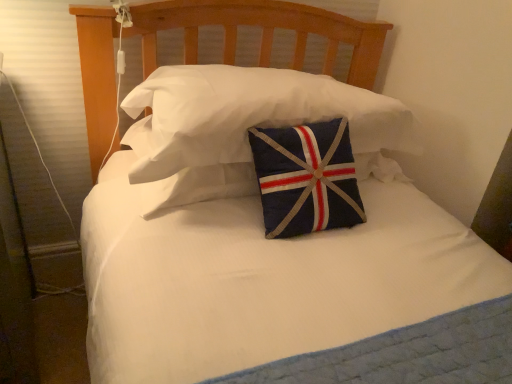
Measure the distance between point [273,116] and camera.

The distance of point [273,116] from camera is 1.03 meters.

Locate an element on the screen. quilted fabric pillow at center, which is the second pillow from bottom to top is located at coordinates (250, 115).

Describe the element at coordinates (250, 115) in the screenshot. I see `quilted fabric pillow at center, which is the second pillow from bottom to top` at that location.

Where is `navy blue fabric pillow at center, the 1th pillow from the bottom`? navy blue fabric pillow at center, the 1th pillow from the bottom is located at coordinates (199, 187).

What do you see at coordinates (199, 187) in the screenshot? The height and width of the screenshot is (384, 512). I see `navy blue fabric pillow at center, the 1th pillow from the bottom` at bounding box center [199, 187].

The height and width of the screenshot is (384, 512). Identify the location of quilted fabric pillow at center, which is the second pillow from bottom to top. (250, 115).

Which is more to the left, navy blue fabric pillow at center, which is the second pillow from top to bottom, or quilted fabric pillow at center, marked as the 1th pillow in a top-to-bottom arrangement?

From the viewer's perspective, navy blue fabric pillow at center, which is the second pillow from top to bottom, appears more on the left side.

Considering the positions of objects navy blue fabric pillow at center, the 1th pillow from the bottom, and quilted fabric pillow at center, which is the second pillow from bottom to top, in the image provided, who is behind, navy blue fabric pillow at center, the 1th pillow from the bottom, or quilted fabric pillow at center, which is the second pillow from bottom to top,?

Positioned behind is navy blue fabric pillow at center, the 1th pillow from the bottom.

Is point (154, 212) more distant than point (329, 92)?

No.

From the image's perspective, is navy blue fabric pillow at center, which is the second pillow from top to bottom, below quilted fabric pillow at center, which is the second pillow from bottom to top?

Yes, from the image's perspective, navy blue fabric pillow at center, which is the second pillow from top to bottom, is below quilted fabric pillow at center, which is the second pillow from bottom to top.

From a real-world perspective, is navy blue fabric pillow at center, which is the second pillow from top to bottom, over quilted fabric pillow at center, which is the second pillow from bottom to top?

No, from a real-world perspective, navy blue fabric pillow at center, which is the second pillow from top to bottom, is not on top of quilted fabric pillow at center, which is the second pillow from bottom to top.

In terms of width, does navy blue fabric pillow at center, the 1th pillow from the bottom, look wider or thinner when compared to quilted fabric pillow at center, marked as the 1th pillow in a top-to-bottom arrangement?

In the image, navy blue fabric pillow at center, the 1th pillow from the bottom, appears to be wider than quilted fabric pillow at center, marked as the 1th pillow in a top-to-bottom arrangement.

Considering the sizes of objects navy blue fabric pillow at center, the 1th pillow from the bottom, and quilted fabric pillow at center, marked as the 1th pillow in a top-to-bottom arrangement, in the image provided, who is shorter, navy blue fabric pillow at center, the 1th pillow from the bottom, or quilted fabric pillow at center, marked as the 1th pillow in a top-to-bottom arrangement,?

navy blue fabric pillow at center, the 1th pillow from the bottom.

Does navy blue fabric pillow at center, the 1th pillow from the bottom, have a larger size compared to quilted fabric pillow at center, marked as the 1th pillow in a top-to-bottom arrangement?

Actually, navy blue fabric pillow at center, the 1th pillow from the bottom, might be smaller than quilted fabric pillow at center, marked as the 1th pillow in a top-to-bottom arrangement.

Can we say navy blue fabric pillow at center, which is the second pillow from top to bottom, lies outside quilted fabric pillow at center, marked as the 1th pillow in a top-to-bottom arrangement?

Yes.

Are navy blue fabric pillow at center, which is the second pillow from top to bottom, and quilted fabric pillow at center, which is the second pillow from bottom to top, far apart?

No, navy blue fabric pillow at center, which is the second pillow from top to bottom, is in close proximity to quilted fabric pillow at center, which is the second pillow from bottom to top.

Is navy blue fabric pillow at center, the 1th pillow from the bottom, positioned with its back to quilted fabric pillow at center, which is the second pillow from bottom to top?

No.

Identify the location of pillow to the left of quilted fabric pillow at center, which is the second pillow from bottom to top. This screenshot has width=512, height=384. (199, 187).

Which object is positioned more to the left, quilted fabric pillow at center, which is the second pillow from bottom to top, or navy blue fabric pillow at center, the 1th pillow from the bottom?

From the viewer's perspective, navy blue fabric pillow at center, the 1th pillow from the bottom, appears more on the left side.

Consider the image. Considering the relative positions of quilted fabric pillow at center, marked as the 1th pillow in a top-to-bottom arrangement, and navy blue fabric pillow at center, which is the second pillow from top to bottom, in the image provided, is quilted fabric pillow at center, marked as the 1th pillow in a top-to-bottom arrangement, behind navy blue fabric pillow at center, which is the second pillow from top to bottom,?

No, it is not.

Does point (394, 147) come in front of point (396, 171)?

Yes, it is.

From the image's perspective, is quilted fabric pillow at center, which is the second pillow from bottom to top, beneath navy blue fabric pillow at center, which is the second pillow from top to bottom?

Incorrect, from the image's perspective, quilted fabric pillow at center, which is the second pillow from bottom to top, is higher than navy blue fabric pillow at center, which is the second pillow from top to bottom.

From a real-world perspective, is quilted fabric pillow at center, marked as the 1th pillow in a top-to-bottom arrangement, positioned over navy blue fabric pillow at center, the 1th pillow from the bottom, based on gravity?

Yes, from a real-world perspective, quilted fabric pillow at center, marked as the 1th pillow in a top-to-bottom arrangement, is above navy blue fabric pillow at center, the 1th pillow from the bottom.

Can you confirm if quilted fabric pillow at center, marked as the 1th pillow in a top-to-bottom arrangement, is wider than navy blue fabric pillow at center, the 1th pillow from the bottom?

No, quilted fabric pillow at center, marked as the 1th pillow in a top-to-bottom arrangement, is not wider than navy blue fabric pillow at center, the 1th pillow from the bottom.

Between quilted fabric pillow at center, which is the second pillow from bottom to top, and navy blue fabric pillow at center, which is the second pillow from top to bottom, which one has less height?

With less height is navy blue fabric pillow at center, which is the second pillow from top to bottom.

Can you confirm if quilted fabric pillow at center, which is the second pillow from bottom to top, is bigger than navy blue fabric pillow at center, which is the second pillow from top to bottom?

Correct, quilted fabric pillow at center, which is the second pillow from bottom to top, is larger in size than navy blue fabric pillow at center, which is the second pillow from top to bottom.

Would you say quilted fabric pillow at center, marked as the 1th pillow in a top-to-bottom arrangement, is inside or outside navy blue fabric pillow at center, which is the second pillow from top to bottom?

quilted fabric pillow at center, marked as the 1th pillow in a top-to-bottom arrangement, exists outside the volume of navy blue fabric pillow at center, which is the second pillow from top to bottom.

Is quilted fabric pillow at center, which is the second pillow from bottom to top, far from navy blue fabric pillow at center, which is the second pillow from top to bottom?

No, quilted fabric pillow at center, which is the second pillow from bottom to top, is not far away from navy blue fabric pillow at center, which is the second pillow from top to bottom.

Does quilted fabric pillow at center, marked as the 1th pillow in a top-to-bottom arrangement, turn towards navy blue fabric pillow at center, which is the second pillow from top to bottom?

No, quilted fabric pillow at center, marked as the 1th pillow in a top-to-bottom arrangement, does not turn towards navy blue fabric pillow at center, which is the second pillow from top to bottom.

This screenshot has width=512, height=384. I want to click on pillow below the quilted fabric pillow at center, marked as the 1th pillow in a top-to-bottom arrangement (from the image's perspective), so click(199, 187).

Locate an element on the screen. The width and height of the screenshot is (512, 384). pillow lying behind the quilted fabric pillow at center, marked as the 1th pillow in a top-to-bottom arrangement is located at coordinates (199, 187).

Locate an element on the screen. Image resolution: width=512 pixels, height=384 pixels. pillow that appears below the quilted fabric pillow at center, which is the second pillow from bottom to top (from the image's perspective) is located at coordinates (199, 187).